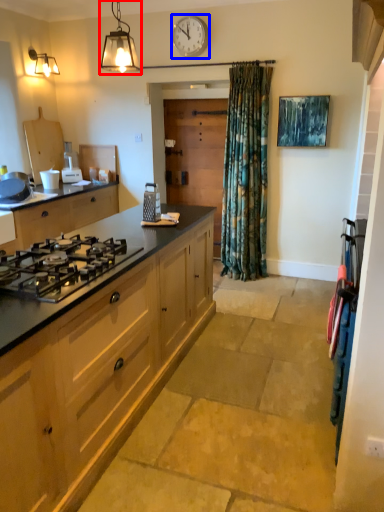
Question: Among these objects, which one is nearest to the camera, light fixture (highlighted by a red box) or clock (highlighted by a blue box)?

Choices:
 (A) light fixture
 (B) clock

Answer: (A)